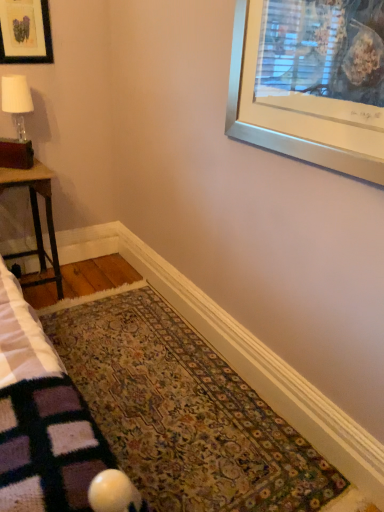
Question: Is point (8, 88) closer or farther from the camera than point (13, 181)?

Choices:
 (A) closer
 (B) farther

Answer: (B)

Question: From a real-world perspective, is matte glass lamp at left physically located above or below wooden table at left?

Choices:
 (A) above
 (B) below

Answer: (A)

Question: Which object is the closest to the matte glass lamp at left?

Choices:
 (A) wooden table at left
 (B) floral carpet at center
 (C) matte black picture frame at upper left

Answer: (C)

Question: Estimate the real-world distances between objects in this image. Which object is farther from the matte glass lamp at left?

Choices:
 (A) wooden table at left
 (B) matte black picture frame at upper left
 (C) floral carpet at center

Answer: (C)